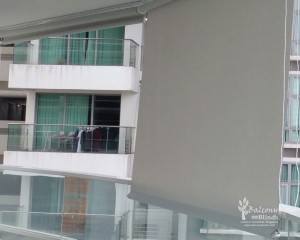
Identify the location of ceiling. (66, 11).